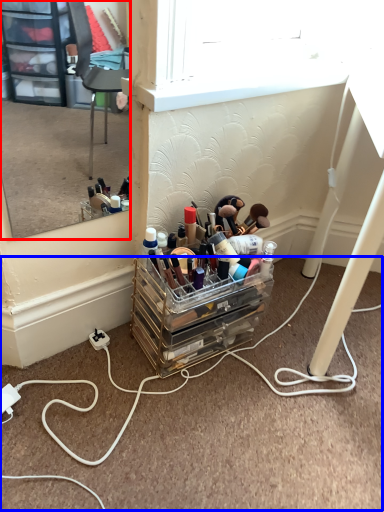
Question: Which object is closer to the camera taking this photo, mirror (highlighted by a red box) or cable (highlighted by a blue box)?

Choices:
 (A) mirror
 (B) cable

Answer: (A)